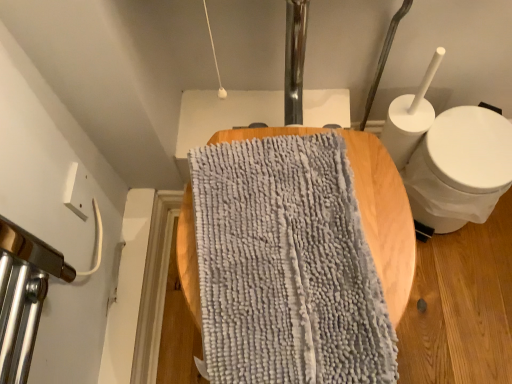
Image resolution: width=512 pixels, height=384 pixels. Find the location of `white matte toilet at right`. white matte toilet at right is located at coordinates tap(460, 168).

What do you see at coordinates (460, 168) in the screenshot?
I see `white matte toilet at right` at bounding box center [460, 168].

This screenshot has width=512, height=384. What do you see at coordinates (286, 266) in the screenshot?
I see `gray fuzzy bath towel at center` at bounding box center [286, 266].

At what (x,y) coordinates should I click in order to perform the action: click on gray fuzzy bath towel at center. Please return your answer as a coordinate pair (x, y). Looking at the image, I should click on (286, 266).

What is the approximate width of gray fuzzy bath towel at center?

It is 16.24 inches.

Image resolution: width=512 pixels, height=384 pixels. Identify the location of white matte toilet at right. (460, 168).

Is gray fuzzy bath towel at center to the left of white matte toilet at right from the viewer's perspective?

Yes, gray fuzzy bath towel at center is to the left of white matte toilet at right.

Between gray fuzzy bath towel at center and white matte toilet at right, which one is positioned in front?

gray fuzzy bath towel at center is closer to the camera.

Looking at this image, which point is more distant from viewer, (246, 167) or (446, 115)?

Point (446, 115)

From the image's perspective, between gray fuzzy bath towel at center and white matte toilet at right, who is located below?

gray fuzzy bath towel at center is shown below in the image.

From a real-world perspective, which is physically below, gray fuzzy bath towel at center or white matte toilet at right?

In real-world perspective, white matte toilet at right is lower.

From the picture: Which of these two, gray fuzzy bath towel at center or white matte toilet at right, is thinner?

white matte toilet at right.

Which of these two, gray fuzzy bath towel at center or white matte toilet at right, stands shorter?

Standing shorter between the two is gray fuzzy bath towel at center.

Considering the relative sizes of gray fuzzy bath towel at center and white matte toilet at right in the image provided, is gray fuzzy bath towel at center bigger than white matte toilet at right?

Incorrect, gray fuzzy bath towel at center is not larger than white matte toilet at right.

Is gray fuzzy bath towel at center outside of white matte toilet at right?

gray fuzzy bath towel at center lies outside white matte toilet at right's area.

Would you say gray fuzzy bath towel at center is a long distance from white matte toilet at right?

They are positioned close to each other.

Could you tell me if gray fuzzy bath towel at center is facing white matte toilet at right?

No.

Based on the photo, how much distance is there between gray fuzzy bath towel at center and white matte toilet at right?

The distance of gray fuzzy bath towel at center from white matte toilet at right is 43.59 centimeters.

Find the location of a particular element. bath towel above the white matte toilet at right (from a real-world perspective) is located at coordinates (286, 266).

Is white matte toilet at right at the left side of gray fuzzy bath towel at center?

No, white matte toilet at right is not to the left of gray fuzzy bath towel at center.

In the image, is white matte toilet at right positioned in front of or behind gray fuzzy bath towel at center?

In the image, white matte toilet at right appears behind gray fuzzy bath towel at center.

Does point (434, 177) appear closer or farther from the camera than point (342, 211)?

Point (434, 177) appears to be farther away from the viewer than point (342, 211).

Looking at this image, from the image's perspective, who appears lower, white matte toilet at right or gray fuzzy bath towel at center?

From the image's view, gray fuzzy bath towel at center is below.

From the picture: From a real-world perspective, is white matte toilet at right on top of gray fuzzy bath towel at center?

No, from a real-world perspective, white matte toilet at right is not over gray fuzzy bath towel at center

Which of these two, white matte toilet at right or gray fuzzy bath towel at center, is wider?

Wider between the two is gray fuzzy bath towel at center.

Is white matte toilet at right shorter than gray fuzzy bath towel at center?

No, white matte toilet at right is not shorter than gray fuzzy bath towel at center.

Is white matte toilet at right smaller than gray fuzzy bath towel at center?

No.

Is white matte toilet at right inside the boundaries of gray fuzzy bath towel at center, or outside?

white matte toilet at right lies outside gray fuzzy bath towel at center.

Is white matte toilet at right directly adjacent to gray fuzzy bath towel at center?

No, white matte toilet at right is not touching gray fuzzy bath towel at center.

Could you tell me if white matte toilet at right is facing gray fuzzy bath towel at center?

No, white matte toilet at right is not oriented towards gray fuzzy bath towel at center.

Measure the distance from white matte toilet at right to gray fuzzy bath towel at center.

The distance of white matte toilet at right from gray fuzzy bath towel at center is 43.59 centimeters.

Identify the location of bath towel that is above the white matte toilet at right (from a real-world perspective). This screenshot has width=512, height=384. (286, 266).

This screenshot has width=512, height=384. Find the location of `toilet on the right side of gray fuzzy bath towel at center`. toilet on the right side of gray fuzzy bath towel at center is located at coordinates (460, 168).

The height and width of the screenshot is (384, 512). Identify the location of bath towel that is in front of the white matte toilet at right. (286, 266).